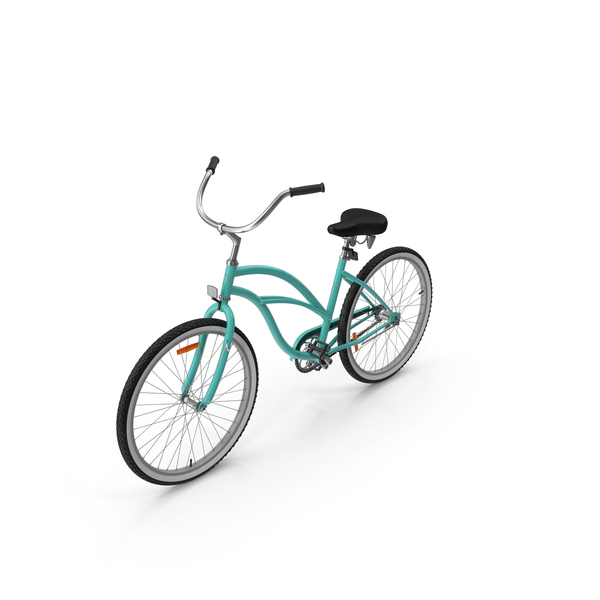
Where is `handle`? The image size is (600, 600). handle is located at coordinates (306, 187).